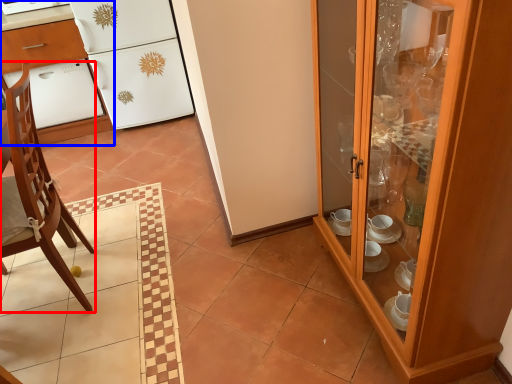
Question: Which object is further to the camera taking this photo, chair (highlighted by a red box) or desk (highlighted by a blue box)?

Choices:
 (A) chair
 (B) desk

Answer: (B)